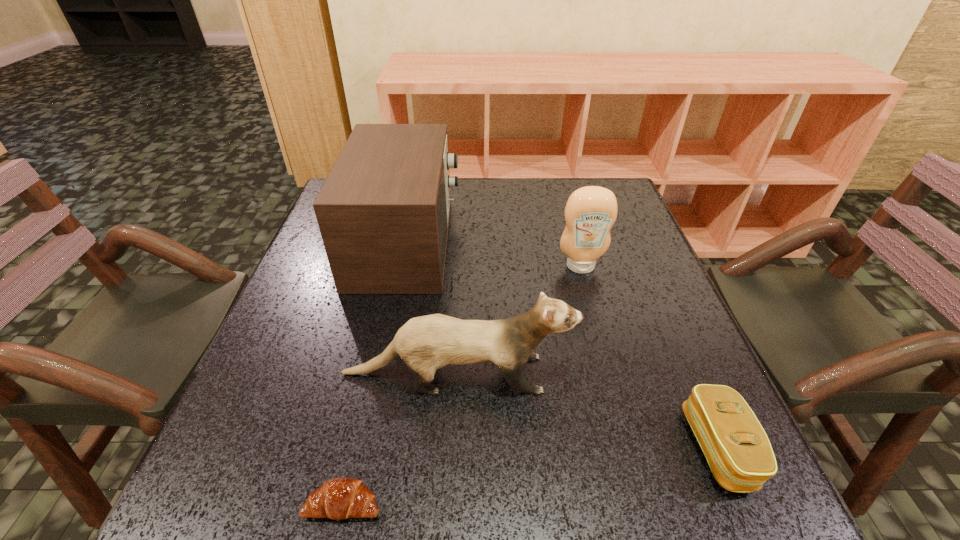
Locate an element on the screen. The image size is (960, 540). free spot between the condiment and the shortest object is located at coordinates (462, 384).

You are a GUI agent. You are given a task and a screenshot of the screen. Output one action in this format:
    pyautogui.click(x=<x>, y=<y>)
    Task: Click on the free space between the second object from right to left and the radio receiver
    The width and height of the screenshot is (960, 540).
    Given the screenshot: What is the action you would take?
    pyautogui.click(x=493, y=254)

The width and height of the screenshot is (960, 540). Find the location of `vacant space in between the shortest object and the radio receiver`. vacant space in between the shortest object and the radio receiver is located at coordinates (375, 373).

You are a GUI agent. You are given a task and a screenshot of the screen. Output one action in this format:
    pyautogui.click(x=<x>, y=<y>)
    Task: Click on the vacant space that is in between the second object from right to left and the clutch bag
    The image size is (960, 540).
    Given the screenshot: What is the action you would take?
    pyautogui.click(x=650, y=357)

Identify the location of empty space that is in between the condiment and the crescent roll. (462, 384).

Locate which object is the fourth closest to the radio receiver. Please provide its 2D coordinates. Your answer should be formatted as a tuple, i.e. [(x, y)], where the tuple contains the x and y coordinates of a point satisfying the conditions above.

[(738, 451)]

Point out which object is positioned as the third nearest to the crescent roll. Please provide its 2D coordinates. Your answer should be formatted as a tuple, i.e. [(x, y)], where the tuple contains the x and y coordinates of a point satisfying the conditions above.

[(738, 451)]

Image resolution: width=960 pixels, height=540 pixels. What are the coordinates of `free space that satisfies the following two spatial constraints: 1. on the zipper side of the second shortest object; 2. on the front side of the shortest object` in the screenshot? It's located at (742, 503).